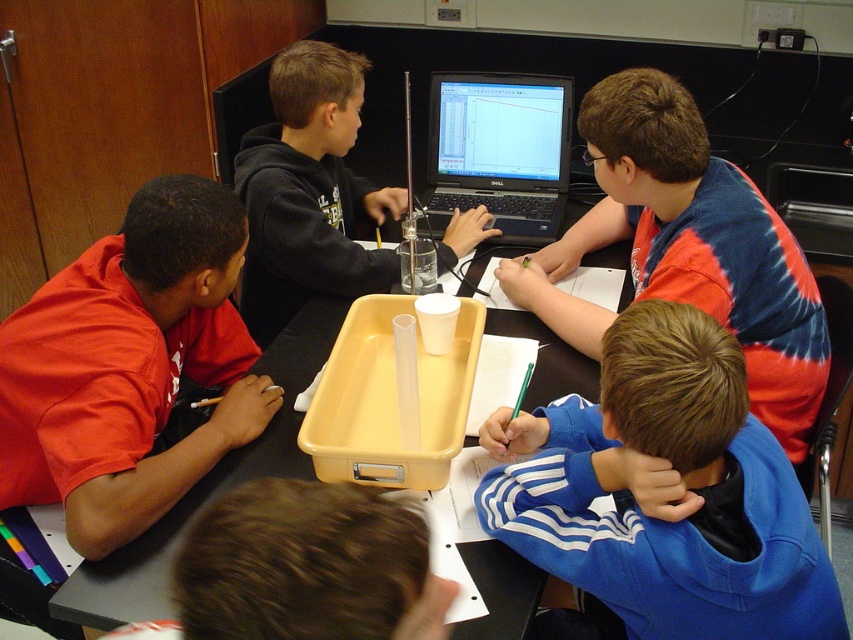
Question: Can you confirm if blue tie-dye shirt at upper right is smaller than matte black laptop at center?

Choices:
 (A) yes
 (B) no

Answer: (B)

Question: Which object is the closest to the black plastic laptop at center?

Choices:
 (A) black plastic tray at center
 (B) matte red shirt at left
 (C) matte black laptop at center

Answer: (C)

Question: Among these objects, which one is nearest to the camera?

Choices:
 (A) blue fleece jacket at lower right
 (B) matte black laptop at center
 (C) matte black hoodie at center
 (D) black plastic tray at center

Answer: (A)

Question: Does blue fleece jacket at lower right appear under black plastic tray at center?

Choices:
 (A) yes
 (B) no

Answer: (A)

Question: Does matte red shirt at left have a lesser width compared to matte black laptop at center?

Choices:
 (A) no
 (B) yes

Answer: (A)

Question: Which object is closer to the camera taking this photo?

Choices:
 (A) blue tie-dye shirt at upper right
 (B) matte red shirt at left

Answer: (B)